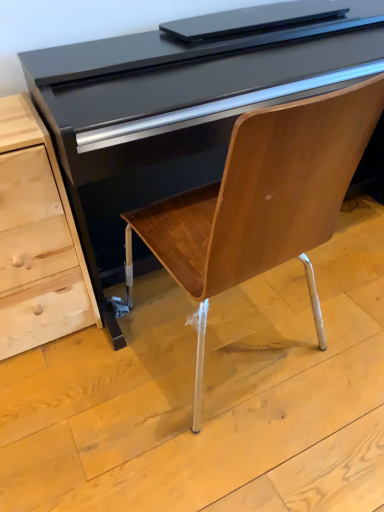
What do you see at coordinates (37, 239) in the screenshot?
I see `light wood chest of drawers at left` at bounding box center [37, 239].

Where is `light wood chest of drawers at left`? Image resolution: width=384 pixels, height=512 pixels. light wood chest of drawers at left is located at coordinates (37, 239).

This screenshot has width=384, height=512. Describe the element at coordinates (183, 104) in the screenshot. I see `glossy black piano at center` at that location.

Image resolution: width=384 pixels, height=512 pixels. In order to click on glossy black piano at center in this screenshot , I will do pyautogui.click(x=183, y=104).

Locate an element on the screen. This screenshot has width=384, height=512. light wood chest of drawers at left is located at coordinates (37, 239).

In the scene shown: Between light wood chest of drawers at left and glossy black piano at center, which one appears on the right side from the viewer's perspective?

glossy black piano at center.

Which object is further away from the camera taking this photo, light wood chest of drawers at left or glossy black piano at center?

light wood chest of drawers at left is further from the camera.

Which is in front, point (10, 133) or point (382, 42)?

The point (10, 133) is more forward.

From the image's perspective, does light wood chest of drawers at left appear higher than glossy black piano at center?

No, from the image's perspective, light wood chest of drawers at left is not over glossy black piano at center.

From a real-world perspective, is light wood chest of drawers at left positioned above or below glossy black piano at center?

light wood chest of drawers at left is below glossy black piano at center.

Can you confirm if light wood chest of drawers at left is wider than glossy black piano at center?

No.

Who is taller, light wood chest of drawers at left or glossy black piano at center?

glossy black piano at center.

Based on the photo, considering the sizes of objects light wood chest of drawers at left and glossy black piano at center in the image provided, who is bigger, light wood chest of drawers at left or glossy black piano at center?

With larger size is glossy black piano at center.

Would you say light wood chest of drawers at left is outside glossy black piano at center?

That's correct, light wood chest of drawers at left is outside of glossy black piano at center.

Are light wood chest of drawers at left and glossy black piano at center far apart?

No, light wood chest of drawers at left is in close proximity to glossy black piano at center.

Is light wood chest of drawers at left aimed at glossy black piano at center?

No, light wood chest of drawers at left is not aimed at glossy black piano at center.

Can you tell me how much light wood chest of drawers at left and glossy black piano at center differ in facing direction?

180 degrees.

At what (x,y) coordinates should I click in order to perform the action: click on chest of drawers below the glossy black piano at center (from a real-world perspective). Please return your answer as a coordinate pair (x, y). The width and height of the screenshot is (384, 512). Looking at the image, I should click on (37, 239).

In the scene shown: Is glossy black piano at center at the left side of light wood chest of drawers at left?

No, glossy black piano at center is not to the left of light wood chest of drawers at left.

Considering their positions, is glossy black piano at center located in front of or behind light wood chest of drawers at left?

Visually, glossy black piano at center is located in front of light wood chest of drawers at left.

Does point (299, 67) lie behind point (58, 196)?

No, (299, 67) is in front of (58, 196).

From the image's perspective, is glossy black piano at center located above or below light wood chest of drawers at left?

glossy black piano at center is above light wood chest of drawers at left.

From a real-world perspective, is glossy black piano at center physically above light wood chest of drawers at left?

Yes, from a real-world perspective, glossy black piano at center is above light wood chest of drawers at left.

Is glossy black piano at center thinner than light wood chest of drawers at left?

In fact, glossy black piano at center might be wider than light wood chest of drawers at left.

In terms of height, does glossy black piano at center look taller or shorter compared to light wood chest of drawers at left?

Clearly, glossy black piano at center is taller compared to light wood chest of drawers at left.

Can you confirm if glossy black piano at center is smaller than light wood chest of drawers at left?

No, glossy black piano at center is not smaller than light wood chest of drawers at left.

Can light wood chest of drawers at left be found inside glossy black piano at center?

No, light wood chest of drawers at left is located outside of glossy black piano at center.

Is glossy black piano at center not close to light wood chest of drawers at left?

No, glossy black piano at center is in close proximity to light wood chest of drawers at left.

Consider the image. Is glossy black piano at center facing away from light wood chest of drawers at left?

No, glossy black piano at center's orientation is not away from light wood chest of drawers at left.

How different are the orientations of glossy black piano at center and light wood chest of drawers at left in degrees?

glossy black piano at center and light wood chest of drawers at left are facing 180 degrees away from each other.

How much distance is there between glossy black piano at center and light wood chest of drawers at left?

The distance of glossy black piano at center from light wood chest of drawers at left is 27.52 centimeters.

In the image, there is a light wood chest of drawers at left. Where is `desk above it (from the image's perspective)`? desk above it (from the image's perspective) is located at coordinates (183, 104).

This screenshot has height=512, width=384. Find the location of `chest of drawers below the glossy black piano at center (from a real-world perspective)`. chest of drawers below the glossy black piano at center (from a real-world perspective) is located at coordinates (37, 239).

Where is `desk in front of the light wood chest of drawers at left`? desk in front of the light wood chest of drawers at left is located at coordinates (183, 104).